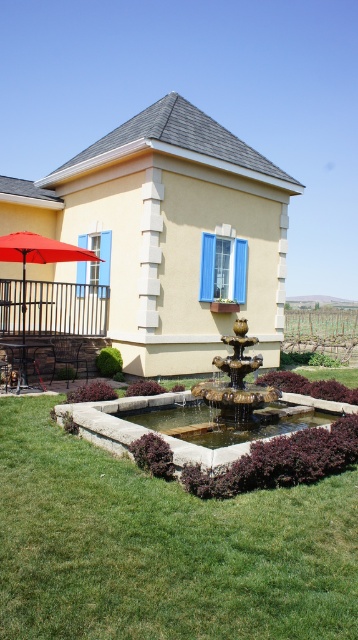
Question: Is gold metallic fountain at center smaller than red matte umbrella at left?

Choices:
 (A) yes
 (B) no

Answer: (B)

Question: Is clear stone fountain at center bigger than red matte umbrella at left?

Choices:
 (A) yes
 (B) no

Answer: (A)

Question: Does clear stone fountain at center appear on the left side of red matte umbrella at left?

Choices:
 (A) no
 (B) yes

Answer: (A)

Question: Which of the following is the closest to the observer?

Choices:
 (A) clear stone fountain at center
 (B) gold metallic fountain at center
 (C) red matte umbrella at left

Answer: (A)

Question: Among these objects, which one is farthest from the camera?

Choices:
 (A) clear stone fountain at center
 (B) gold metallic fountain at center
 (C) red matte umbrella at left

Answer: (C)

Question: Which point is closer to the camera?

Choices:
 (A) (60, 253)
 (B) (228, 417)
 (C) (158, 419)

Answer: (B)